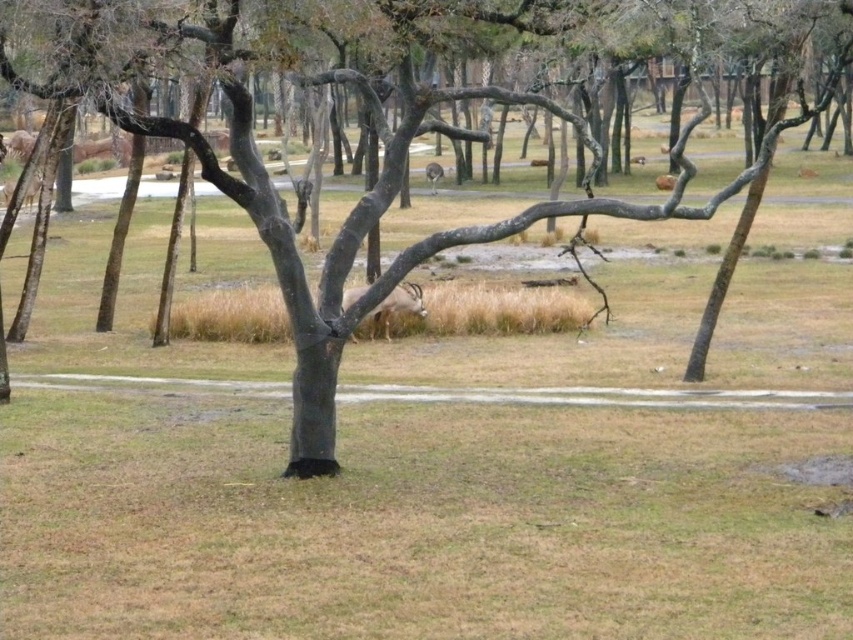
You are a photographer trying to capture both the brown bark tree at center and the brown fur antelope at center in a single frame. Based on their sizes, which object should you focus on first to ensure both fit in the shot?

The brown bark tree at center might be wider than brown fur antelope at center, so you should focus on the brown bark tree at center first to ensure it fits in the frame, allowing space for the antelope.

You are a photographer trying to capture both the brown bark tree at center and the brown furry antelope at center in a single frame. Given their sizes, which one will appear larger in your photo?

The brown bark tree at center will appear larger in the photo because it is bigger than the brown furry antelope at center according to the description.

You are standing at point A in the park and want to find the brown bark tree at center. According to the map, the coordinates of the brown bark tree at center are at point [386,188]. If you are currently at point A, which is at coordinates 0.3, 0.45, are you close to the brown bark tree at center?

Yes, you are very close to the brown bark tree at center because your current coordinates at 0.3, 0.45 are nearly identical to the tree at [386,188].